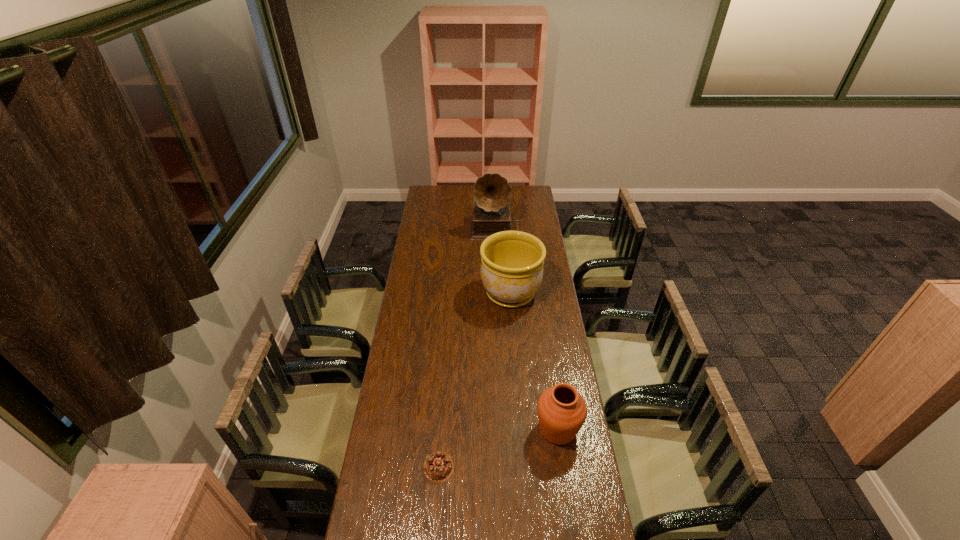
Where is `vacant space located on the left of the urn`? vacant space located on the left of the urn is located at coordinates (518, 429).

This screenshot has height=540, width=960. Identify the location of free space located on the front of the shortest object. (437, 505).

Where is `record player that is at the right edge`? The image size is (960, 540). record player that is at the right edge is located at coordinates (491, 213).

Where is `flowerpot positioned at the right edge`? This screenshot has width=960, height=540. flowerpot positioned at the right edge is located at coordinates (511, 270).

The image size is (960, 540). Identify the location of urn present at the right edge. (562, 411).

Locate an element on the screen. blank space at the far edge is located at coordinates (468, 196).

Where is `free space at the left edge of the desktop`? The width and height of the screenshot is (960, 540). free space at the left edge of the desktop is located at coordinates (440, 217).

At what (x,y) coordinates should I click in order to perform the action: click on vacant space at the right edge. Please return your answer as a coordinate pair (x, y). This screenshot has width=960, height=540. Looking at the image, I should click on (544, 238).

In the image, there is a desktop. Find the location of `vacant space at the far left corner`. vacant space at the far left corner is located at coordinates (445, 196).

The image size is (960, 540). I want to click on vacant area that lies between the leftmost object and the third nearest object, so click(x=475, y=380).